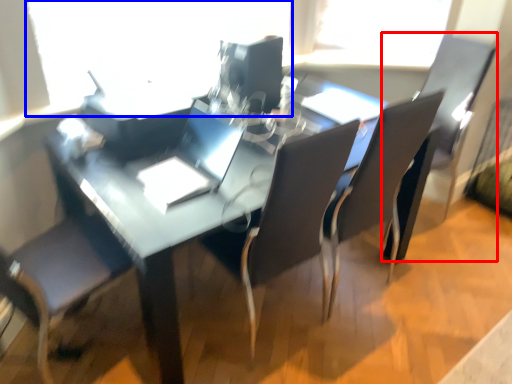
Question: Which point is further to the camera, armchair (highlighted by a red box) or window screen (highlighted by a blue box)?

Choices:
 (A) armchair
 (B) window screen

Answer: (A)